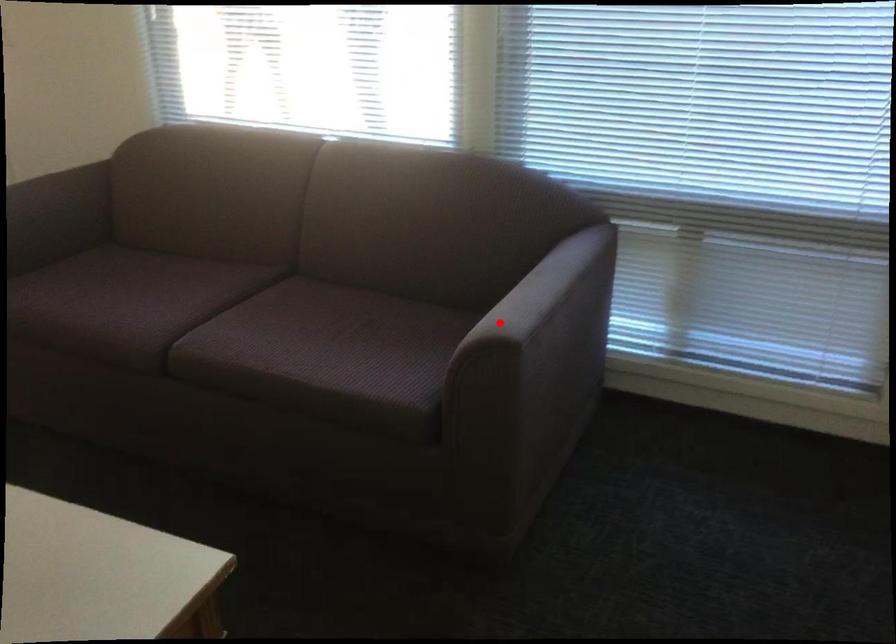
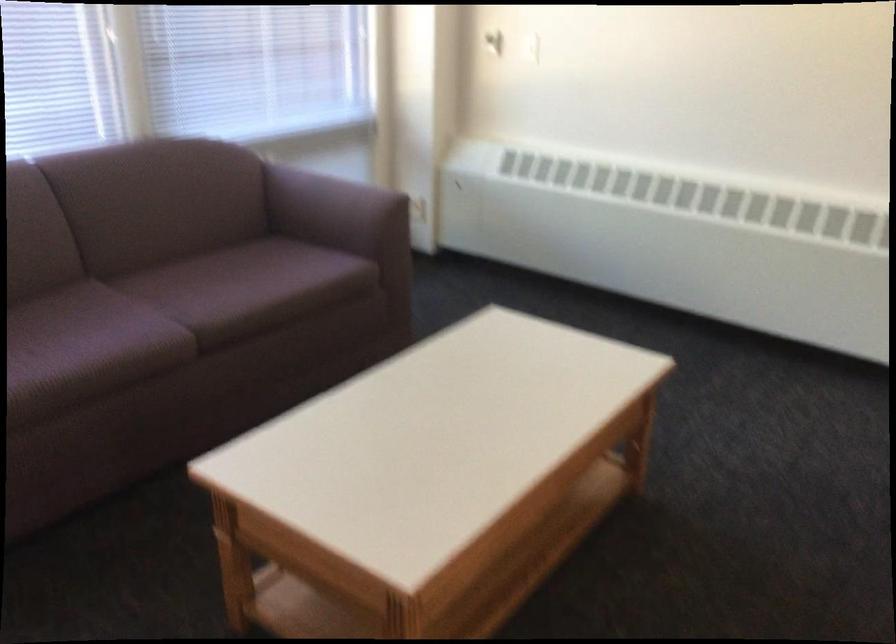
Question: I am providing you with two images of the same scene from different viewpoints. In image1, a red point is highlighted. Considering the same 3D point in image2, which of the following is correct?

Choices:
 (A) It is closer
 (B) It is farther

Answer: (B)